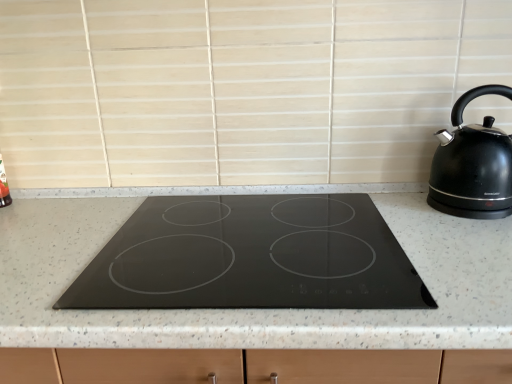
Locate an element on the screen. Image resolution: width=512 pixels, height=384 pixels. black glossy kettle at right is located at coordinates (473, 164).

The width and height of the screenshot is (512, 384). What do you see at coordinates (473, 164) in the screenshot?
I see `black glossy kettle at right` at bounding box center [473, 164].

What are the coordinates of `black granite countertop at center` in the screenshot? It's located at (258, 309).

What is the approximate height of black granite countertop at center?

black granite countertop at center is 26.31 inches in height.

What do you see at coordinates (258, 309) in the screenshot? The width and height of the screenshot is (512, 384). I see `black granite countertop at center` at bounding box center [258, 309].

You are a GUI agent. You are given a task and a screenshot of the screen. Output one action in this format:
    pyautogui.click(x=<x>, y=<y>)
    Task: Click on the black glossy kettle at right
    
    Given the screenshot: What is the action you would take?
    pyautogui.click(x=473, y=164)

Visually, is black granite countertop at center positioned to the left or to the right of black glossy kettle at right?

black granite countertop at center is to the left of black glossy kettle at right.

Which is in front, black granite countertop at center or black glossy kettle at right?

black granite countertop at center is more forward.

Considering the points (352, 313) and (443, 183), which point is in front, point (352, 313) or point (443, 183)?

The point (352, 313) is more forward.

From the image's perspective, between black granite countertop at center and black glossy kettle at right, who is located below?

black granite countertop at center, from the image's perspective.

From a real-world perspective, is black granite countertop at center beneath black glossy kettle at right?

Yes.

Does black granite countertop at center have a greater width compared to black glossy kettle at right?

Correct, the width of black granite countertop at center exceeds that of black glossy kettle at right.

Considering the relative sizes of black granite countertop at center and black glossy kettle at right in the image provided, is black granite countertop at center taller than black glossy kettle at right?

Yes.

Does black granite countertop at center have a larger size compared to black glossy kettle at right?

Correct, black granite countertop at center is larger in size than black glossy kettle at right.

Is black granite countertop at center situated inside black glossy kettle at right or outside?

black granite countertop at center is outside black glossy kettle at right.

Would you say black granite countertop at center is a long distance from black glossy kettle at right?

No, there isn't a large distance between black granite countertop at center and black glossy kettle at right.

Does black granite countertop at center turn towards black glossy kettle at right?

No, black granite countertop at center is not oriented towards black glossy kettle at right.

How many degrees apart are the facing directions of black granite countertop at center and black glossy kettle at right?

They differ by 1.35 degrees in their facing directions.

Measure the distance from black granite countertop at center to black glossy kettle at right.

black granite countertop at center and black glossy kettle at right are 28.95 centimeters apart.

Image resolution: width=512 pixels, height=384 pixels. What are the coordinates of `countertop in front of the black glossy kettle at right` in the screenshot? It's located at (258, 309).

Can you confirm if black glossy kettle at right is positioned to the right of black granite countertop at center?

Indeed, black glossy kettle at right is positioned on the right side of black granite countertop at center.

Relative to black granite countertop at center, is black glossy kettle at right in front or behind?

Clearly, black glossy kettle at right is behind black granite countertop at center.

Considering the positions of points (451, 119) and (406, 217), is point (451, 119) farther from camera compared to point (406, 217)?

Yes, point (451, 119) is farther from viewer.

Consider the image. From the image's perspective, between black glossy kettle at right and black granite countertop at center, who is located below?

black granite countertop at center appears lower in the image.

From a real-world perspective, is black glossy kettle at right positioned under black granite countertop at center based on gravity?

Incorrect, from a real-world perspective, black glossy kettle at right is higher than black granite countertop at center.

Considering the sizes of objects black glossy kettle at right and black granite countertop at center in the image provided, who is wider, black glossy kettle at right or black granite countertop at center?

Wider between the two is black granite countertop at center.

Can you confirm if black glossy kettle at right is shorter than black granite countertop at center?

Correct, black glossy kettle at right is not as tall as black granite countertop at center.

Looking at the image, does black glossy kettle at right seem bigger or smaller compared to black granite countertop at center?

Considering their sizes, black glossy kettle at right takes up less space than black granite countertop at center.

Is black granite countertop at center located within black glossy kettle at right?

Actually, black granite countertop at center is outside black glossy kettle at right.

Are black glossy kettle at right and black granite countertop at center far apart?

That's not correct — black glossy kettle at right is a little close to black granite countertop at center.

From the picture: Is black granite countertop at center at the back of black glossy kettle at right?

No.

Can you tell me how much black glossy kettle at right and black granite countertop at center differ in facing direction?

The angular difference between black glossy kettle at right and black granite countertop at center is 1.35 degrees.

How far apart are black glossy kettle at right and black granite countertop at center?

black glossy kettle at right is 11.40 inches from black granite countertop at center.

Identify the location of countertop below the black glossy kettle at right (from a real-world perspective). The width and height of the screenshot is (512, 384). (258, 309).

I want to click on kettle above the black granite countertop at center (from a real-world perspective), so click(473, 164).

The image size is (512, 384). I want to click on countertop in front of the black glossy kettle at right, so click(x=258, y=309).